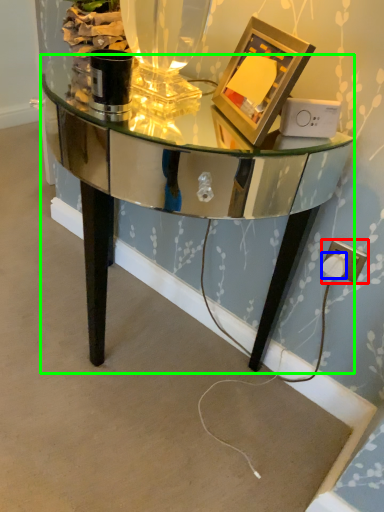
Question: Which is farther away from electric outlet (highlighted by a red box)? plug (highlighted by a blue box) or table (highlighted by a green box)?

Choices:
 (A) plug
 (B) table

Answer: (B)